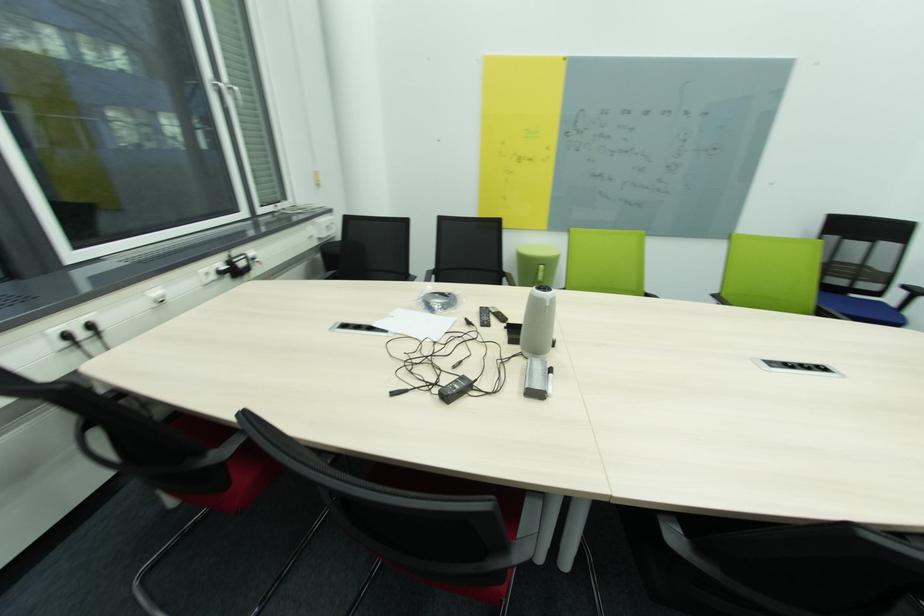
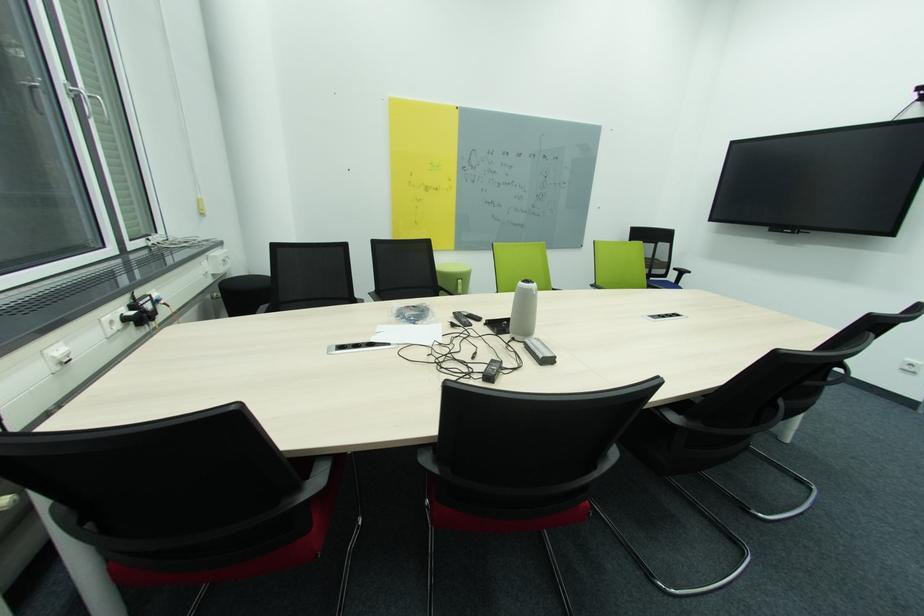
Locate, in the second image, the point that corresponds to the point at 529,354 in the first image.

(521, 339)